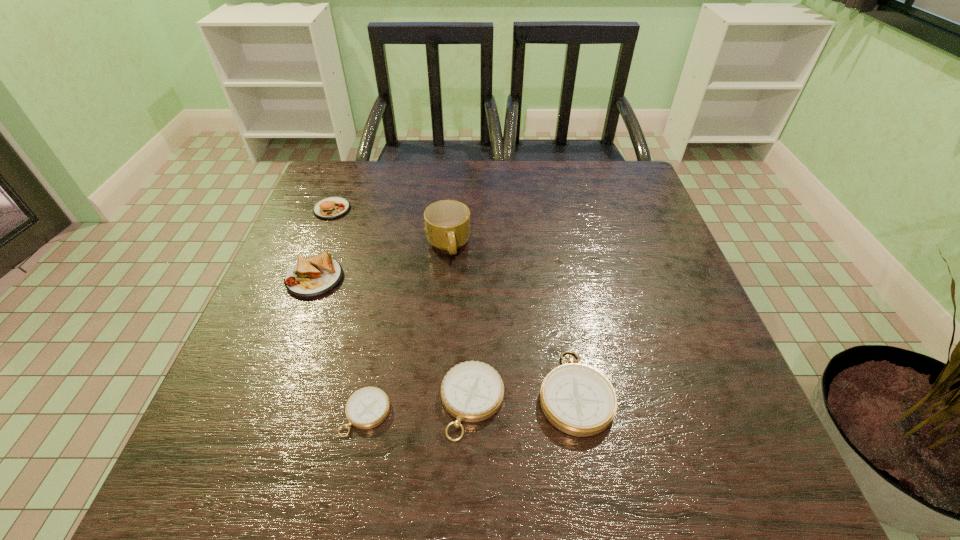
Identify the location of vacant region located 0.400m on the left of the second tallest compass. (215, 402).

You are a GUI agent. You are given a task and a screenshot of the screen. Output one action in this format:
    pyautogui.click(x=<x>, y=<y>)
    Task: Click on the vacant space situated 0.160m on the left of the rightmost object
    The image size is (960, 540).
    Given the screenshot: What is the action you would take?
    pyautogui.click(x=450, y=392)

Where is `free region located on the back of the farthest object`? free region located on the back of the farthest object is located at coordinates (348, 167).

Locate an element on the screen. This screenshot has height=540, width=960. vacant region located 0.110m on the side with the handle of the mug is located at coordinates (444, 301).

What are the coordinates of `vacant space located on the back of the sandwich` in the screenshot? It's located at [x=347, y=192].

Image resolution: width=960 pixels, height=540 pixels. I want to click on object present at the far edge, so click(334, 207).

You are a GUI agent. You are given a task and a screenshot of the screen. Output one action in this format:
    pyautogui.click(x=<x>, y=<y>)
    Task: Click on the patty present at the left edge
    The height and width of the screenshot is (540, 960).
    Given the screenshot: What is the action you would take?
    click(x=334, y=207)

At what (x,y) coordinates should I click in order to perform the action: click on sandwich present at the left edge. Please return your answer as a coordinate pair (x, y). Looking at the image, I should click on (317, 275).

What are the coordinates of `object positioned at the far left corner` in the screenshot? It's located at (x=334, y=207).

Locate an element on the screen. Image resolution: width=960 pixels, height=540 pixels. free space at the far edge is located at coordinates (461, 192).